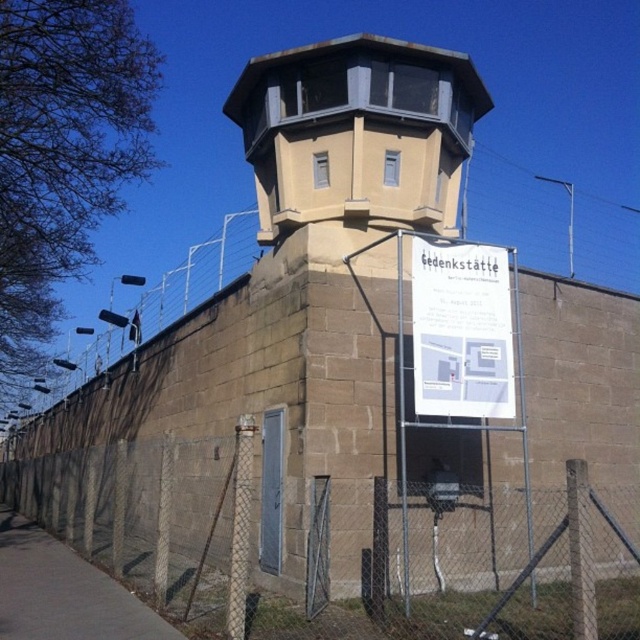
Question: Does brown chain-link fence at lower center have a smaller size compared to white paper sign at center?

Choices:
 (A) no
 (B) yes

Answer: (A)

Question: Estimate the real-world distances between objects in this image. Which object is closer to the beige concrete observation tower at upper center?

Choices:
 (A) white paper sign at center
 (B) brown chain-link fence at lower center
 (C) gray concrete pavement at lower left

Answer: (A)

Question: From the image, what is the correct spatial relationship of beige concrete observation tower at upper center in relation to gray concrete pavement at lower left?

Choices:
 (A) right
 (B) left

Answer: (A)

Question: Which of the following is the closest to the observer?

Choices:
 (A) gray concrete pavement at lower left
 (B) beige concrete observation tower at upper center
 (C) white paper sign at center
 (D) brown chain-link fence at lower center

Answer: (D)

Question: Which of the following is the closest to the observer?

Choices:
 (A) (189, 536)
 (B) (84, 589)
 (C) (504, 328)
 (D) (436, 212)

Answer: (C)

Question: Does beige concrete observation tower at upper center appear over white paper sign at center?

Choices:
 (A) no
 (B) yes

Answer: (B)